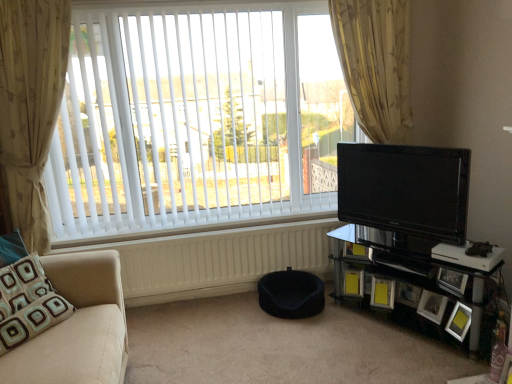
Question: From a real-world perspective, is beige floral fabric curtain at left, which is the second curtain from right to left, physically above yellow matte picture frame at lower right, the first picture frame positioned from the left?

Choices:
 (A) no
 (B) yes

Answer: (B)

Question: Can you confirm if beige floral fabric curtain at left, acting as the 1th curtain starting from the left, is shorter than yellow matte picture frame at lower right, the first picture frame positioned from the left?

Choices:
 (A) yes
 (B) no

Answer: (B)

Question: Considering the relative positions of beige floral fabric curtain at left, acting as the 1th curtain starting from the left, and yellow matte picture frame at lower right, the first picture frame positioned from the left, in the image provided, is beige floral fabric curtain at left, acting as the 1th curtain starting from the left, to the left of yellow matte picture frame at lower right, the first picture frame positioned from the left, from the viewer's perspective?

Choices:
 (A) yes
 (B) no

Answer: (A)

Question: Is beige floral fabric curtain at left, which is the second curtain from right to left, smaller than yellow matte picture frame at lower right, the first picture frame positioned from the left?

Choices:
 (A) no
 (B) yes

Answer: (A)

Question: Is beige floral fabric curtain at left, which is the second curtain from right to left, further to the viewer compared to yellow matte picture frame at lower right, which is the 6th picture frame from right to left?

Choices:
 (A) no
 (B) yes

Answer: (A)

Question: Would you say beige floral fabric curtain at left, which is the second curtain from right to left, contains yellow matte picture frame at lower right, the first picture frame positioned from the left?

Choices:
 (A) yes
 (B) no

Answer: (B)

Question: Is matte black picture frame at lower right, which appears as the third picture frame when viewed from the left, shorter than black glass entertainment center at lower right?

Choices:
 (A) yes
 (B) no

Answer: (A)

Question: Is black glass entertainment center at lower right inside matte black picture frame at lower right, which appears as the third picture frame when viewed from the left?

Choices:
 (A) yes
 (B) no

Answer: (B)

Question: Can you confirm if matte black picture frame at lower right, placed as the fourth picture frame when sorted from right to left, is taller than black glass entertainment center at lower right?

Choices:
 (A) no
 (B) yes

Answer: (A)

Question: Is matte black picture frame at lower right, which appears as the third picture frame when viewed from the left, further to the viewer compared to black glass entertainment center at lower right?

Choices:
 (A) yes
 (B) no

Answer: (A)

Question: Can you confirm if matte black picture frame at lower right, which appears as the third picture frame when viewed from the left, is positioned to the left of black glass entertainment center at lower right?

Choices:
 (A) yes
 (B) no

Answer: (A)

Question: From the image's perspective, is matte black picture frame at lower right, which appears as the third picture frame when viewed from the left, located above black glass entertainment center at lower right?

Choices:
 (A) yes
 (B) no

Answer: (B)

Question: Is beige fabric studio couch at left smaller than wooden photo frame at lower right, which is the 2th picture frame in right-to-left order?

Choices:
 (A) yes
 (B) no

Answer: (B)